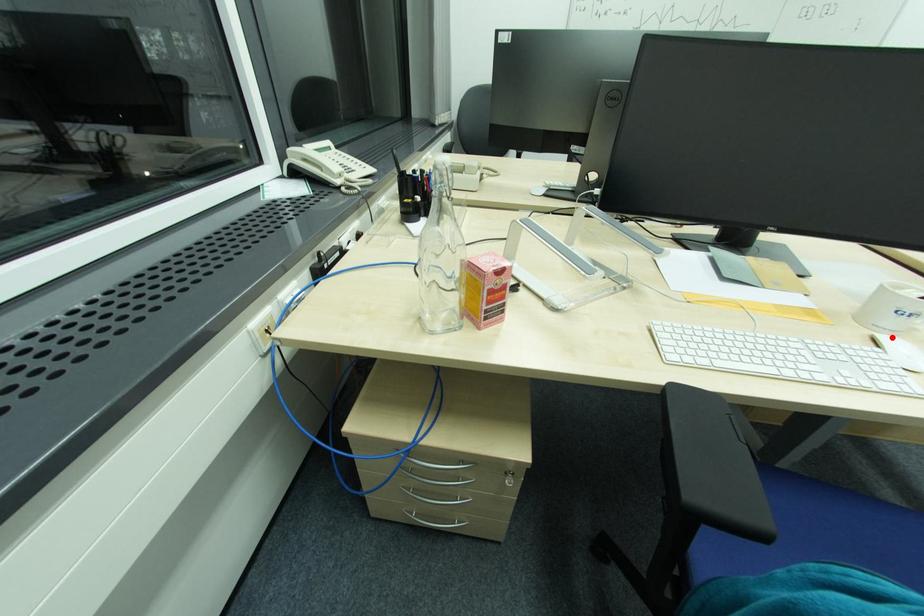
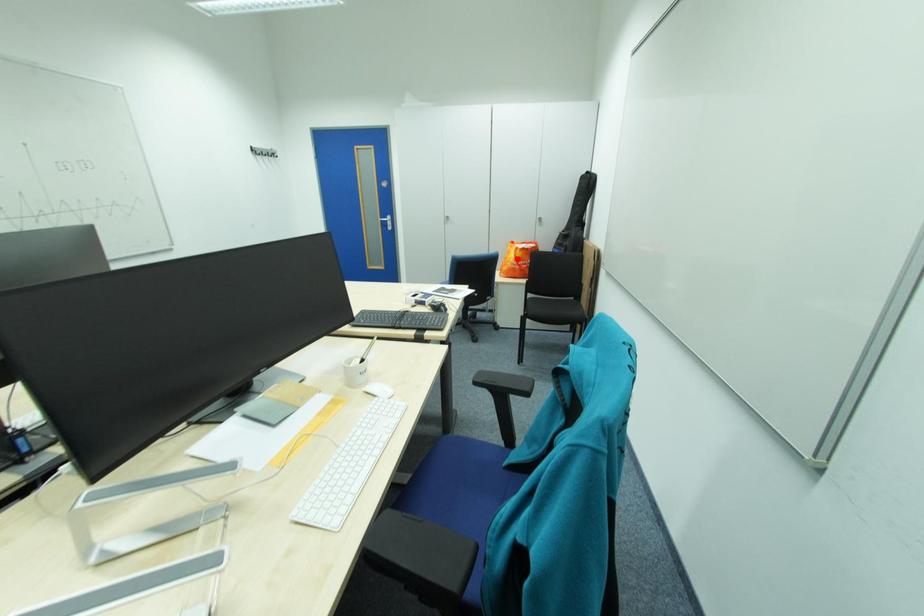
I am providing you with two images of the same scene from different viewpoints. A red point is marked on the first image and another point is marked on the second image. Is the red point in image1 aligned with the point shown in image2?

No